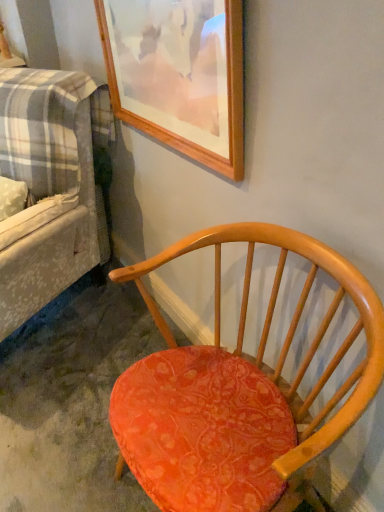
Measure the distance between point (60,165) and camera.

1.56 meters.

What do you see at coordinates (179, 74) in the screenshot? I see `wooden picture frame at upper center` at bounding box center [179, 74].

Locate an element on the screen. Image resolution: width=384 pixels, height=512 pixels. plaid fabric couch at left is located at coordinates (45, 189).

Image resolution: width=384 pixels, height=512 pixels. I want to click on picture frame positioned vertically above the plaid fabric couch at left (from a real-world perspective), so click(x=179, y=74).

Is point (84, 106) behind point (129, 27)?

Yes.

Which is in front, plaid fabric couch at left or wooden picture frame at upper center?

wooden picture frame at upper center is closer to the camera.

Which object is wider, plaid fabric couch at left or wooden picture frame at upper center?

Wider between the two is plaid fabric couch at left.

Considering the positions of points (246, 453) and (180, 34), is point (246, 453) farther from camera compared to point (180, 34)?

No, (246, 453) is in front of (180, 34).

Is matte orange fabric chair at center aimed at wooden picture frame at upper center?

No, matte orange fabric chair at center is not turned towards wooden picture frame at upper center.

Who is more distant, matte orange fabric chair at center or wooden picture frame at upper center?

wooden picture frame at upper center is further from the camera.

Do you think matte orange fabric chair at center is within wooden picture frame at upper center, or outside of it?

matte orange fabric chair at center is not enclosed by wooden picture frame at upper center.

From the image's perspective, would you say wooden picture frame at upper center is shown under plaid fabric couch at left?

Incorrect, from the image's perspective, wooden picture frame at upper center is higher than plaid fabric couch at left.

At what (x,y) coordinates should I click in order to perform the action: click on picture frame above the plaid fabric couch at left (from the image's perspective). Please return your answer as a coordinate pair (x, y). The height and width of the screenshot is (512, 384). Looking at the image, I should click on (179, 74).

Is point (234, 41) farther from viewer compared to point (77, 183)?

No, (234, 41) is in front of (77, 183).

How much distance is there between wooden picture frame at upper center and plaid fabric couch at left?

wooden picture frame at upper center and plaid fabric couch at left are 47.33 centimeters apart from each other.

Is the depth of matte orange fabric chair at center greater than that of plaid fabric couch at left?

No, matte orange fabric chair at center is in front of plaid fabric couch at left.

Who is taller, matte orange fabric chair at center or plaid fabric couch at left?

With more height is plaid fabric couch at left.

Identify the location of chair lying below the plaid fabric couch at left (from the image's perspective). (238, 390).

Consider the image. Between plaid fabric couch at left and matte orange fabric chair at center, which one has more height?

Standing taller between the two is plaid fabric couch at left.

Between wooden picture frame at upper center and matte orange fabric chair at center, which one appears on the left side from the viewer's perspective?

wooden picture frame at upper center.

From the image's perspective, which one is positioned lower, wooden picture frame at upper center or matte orange fabric chair at center?

matte orange fabric chair at center is shown below in the image.

Which is nearer, (201, 12) or (272, 496)?

Point (201, 12).

How many degrees apart are the facing directions of wooden picture frame at upper center and matte orange fabric chair at center?

The angle between the facing direction of wooden picture frame at upper center and the facing direction of matte orange fabric chair at center is 0.00135 degrees.

Locate an element on the screen. The image size is (384, 512). studio couch behind the wooden picture frame at upper center is located at coordinates (45, 189).

Find the location of a particular element. This screenshot has width=384, height=512. picture frame above the matte orange fabric chair at center (from a real-world perspective) is located at coordinates (179, 74).

Which object lies nearer to the anchor point matte orange fabric chair at center, plaid fabric couch at left or wooden picture frame at upper center?

wooden picture frame at upper center is positioned closer to the anchor matte orange fabric chair at center.

When comparing their distances from wooden picture frame at upper center, does plaid fabric couch at left or matte orange fabric chair at center seem closer?

The object closer to wooden picture frame at upper center is plaid fabric couch at left.

Based on their spatial positions, is wooden picture frame at upper center or plaid fabric couch at left closer to matte orange fabric chair at center?

wooden picture frame at upper center is closer to matte orange fabric chair at center.

In the scene shown: Looking at the image, which one is located further to wooden picture frame at upper center, matte orange fabric chair at center or plaid fabric couch at left?

matte orange fabric chair at center is further to wooden picture frame at upper center.

Estimate the real-world distances between objects in this image. Which object is further from plaid fabric couch at left, wooden picture frame at upper center or matte orange fabric chair at center?

matte orange fabric chair at center lies further to plaid fabric couch at left than the other object.

From the image, which object appears to be nearer to plaid fabric couch at left, matte orange fabric chair at center or wooden picture frame at upper center?

The object closer to plaid fabric couch at left is wooden picture frame at upper center.

The image size is (384, 512). I want to click on picture frame situated between plaid fabric couch at left and matte orange fabric chair at center from left to right, so click(179, 74).